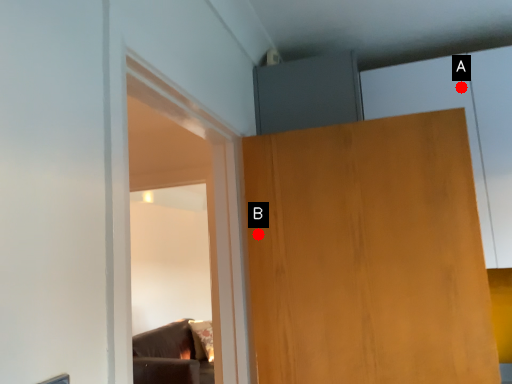
Question: Two points are circled on the image, labeled by A and B beside each circle. Which point is closer to the camera taking this photo?

Choices:
 (A) A is closer
 (B) B is closer

Answer: (B)